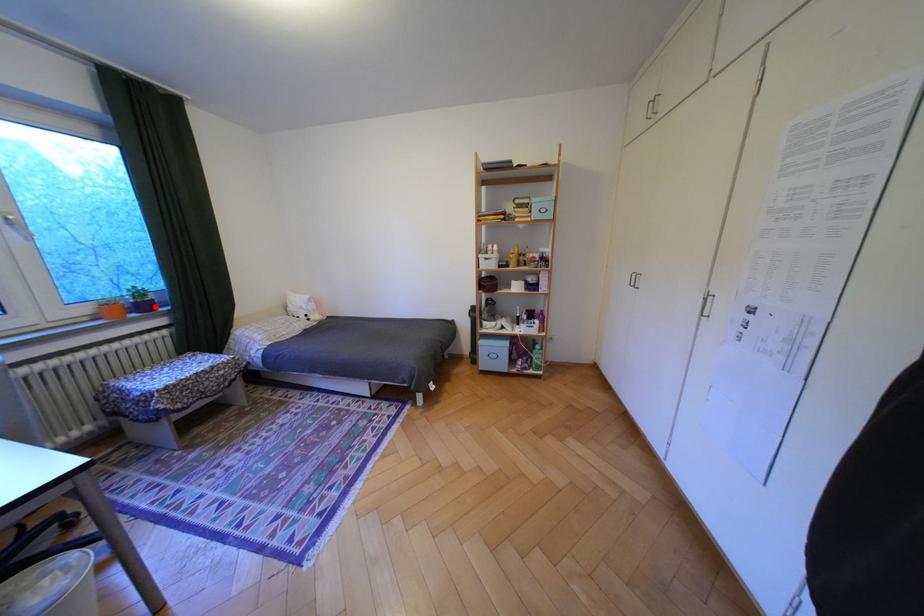
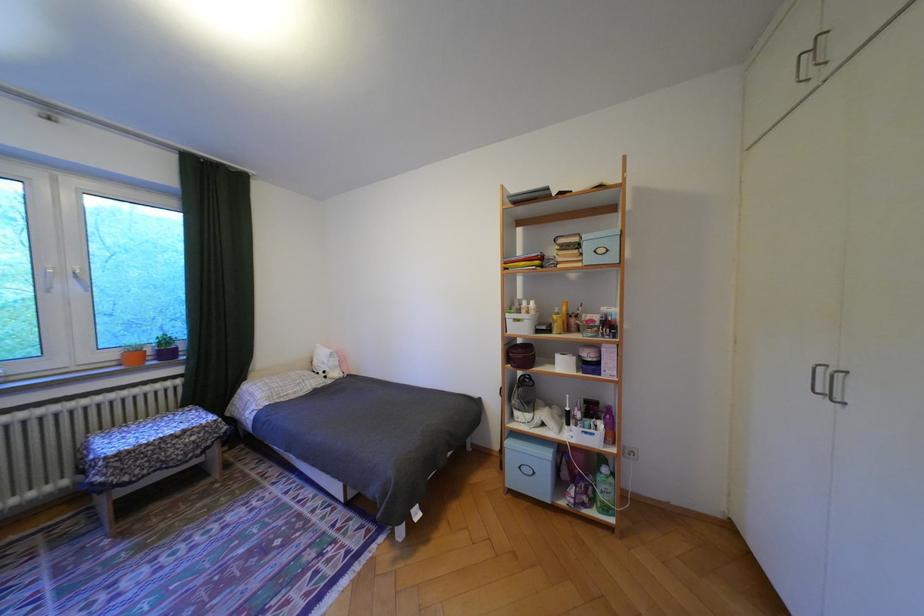
Locate, in the second image, the point that corresponds to the highlighted location in the first image.

(178, 354)